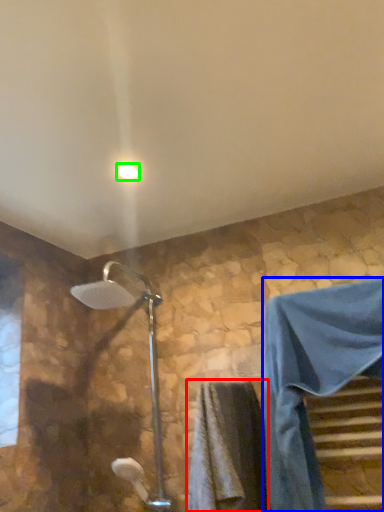
Question: Based on their relative distances, which object is farther from bath towel (highlighted by a red box)? Choose from robe (highlighted by a blue box) and light fixture (highlighted by a green box).

Choices:
 (A) robe
 (B) light fixture

Answer: (B)